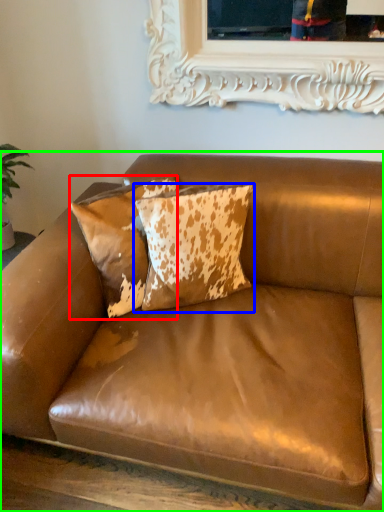
Question: Estimate the real-world distances between objects in this image. Which object is farther from pillow (highlighted by a red box), pillow (highlighted by a blue box) or studio couch (highlighted by a green box)?

Choices:
 (A) pillow
 (B) studio couch

Answer: (B)